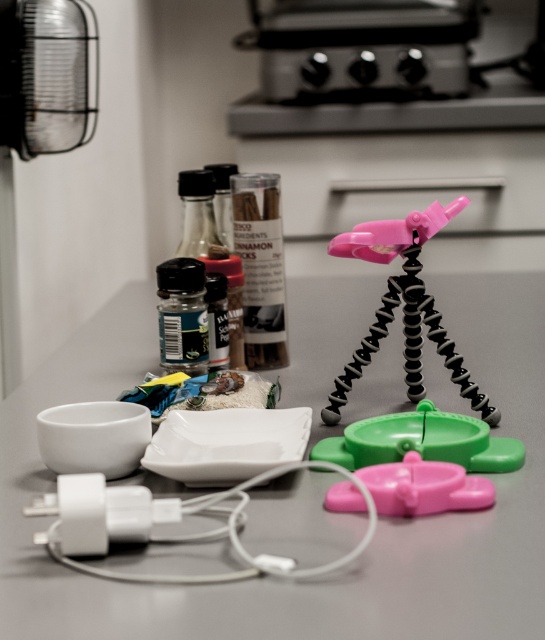
Is black matte spice bottle at center wider than black glass spice at center?

A: Correct, the width of black matte spice bottle at center exceeds that of black glass spice at center.

Locate an element on the screen. black matte spice bottle at center is located at coordinates (196, 212).

Where is `black matte spice bottle at center`? black matte spice bottle at center is located at coordinates (196, 212).

Find the location of a particular element. The height and width of the screenshot is (640, 545). black matte spice bottle at center is located at coordinates (196, 212).

Image resolution: width=545 pixels, height=640 pixels. Describe the element at coordinates (45, 76) in the screenshot. I see `brushed metal fan at upper left` at that location.

Does point (20, 141) come behind point (181, 240)?

That is True.

Image resolution: width=545 pixels, height=640 pixels. I want to click on brushed metal fan at upper left, so click(45, 76).

Looking at this image, who is higher up, green matte spice bottle at center or black glass spice at center?

black glass spice at center

Is green matte spice bottle at center closer to camera compared to black glass spice at center?

Yes, green matte spice bottle at center is in front of black glass spice at center.

Who is more forward, (179, 269) or (227, 202)?

Point (179, 269) is more forward.

Identify the location of green matte spice bottle at center. (183, 316).